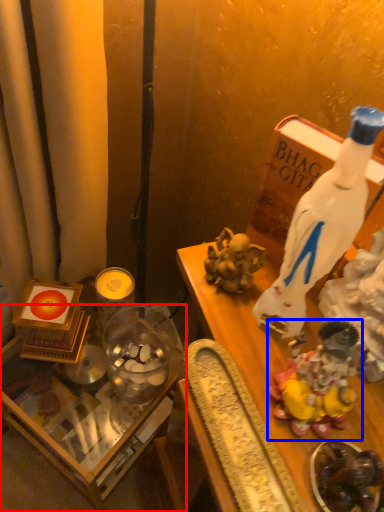
Question: Which object appears closest to the camera in this image, table (highlighted by a red box) or toy (highlighted by a blue box)?

Choices:
 (A) table
 (B) toy

Answer: (B)